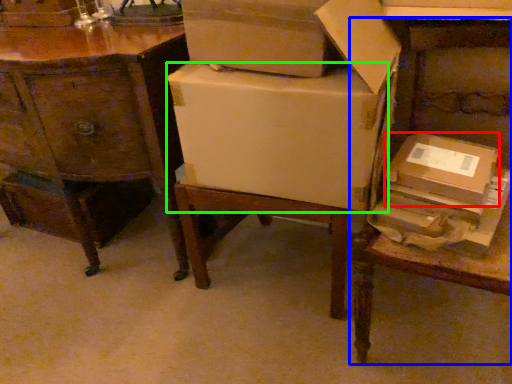
Question: Which object is the closest to the cardboard box (highlighted by a red box)? Choose among these: table (highlighted by a blue box) or cardboard box (highlighted by a green box).

Choices:
 (A) table
 (B) cardboard box

Answer: (A)